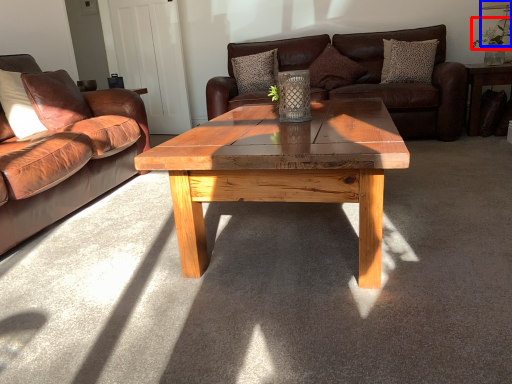
Question: Which object appears closest to the camera in this image, floral arrangement (highlighted by a red box) or lamp (highlighted by a blue box)?

Choices:
 (A) floral arrangement
 (B) lamp

Answer: (A)